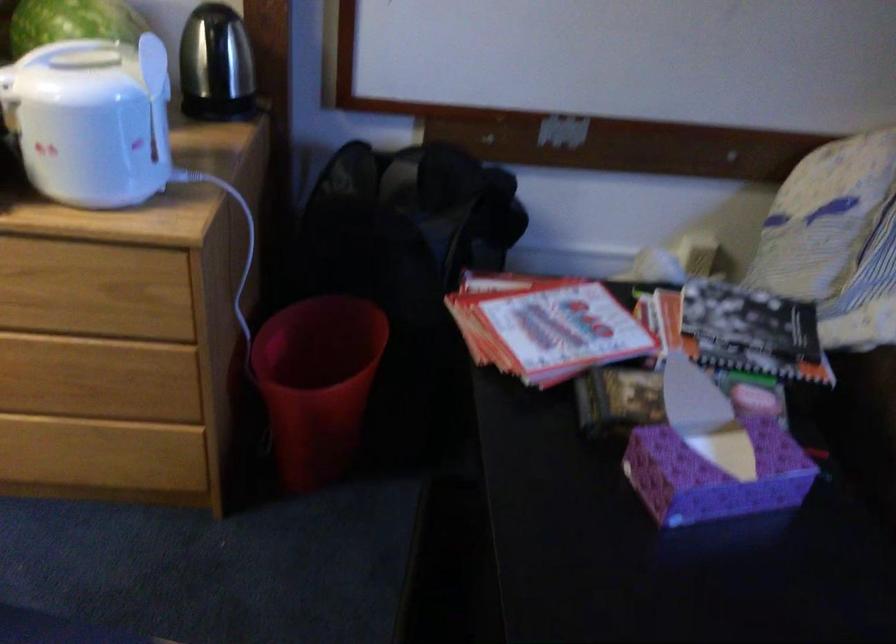
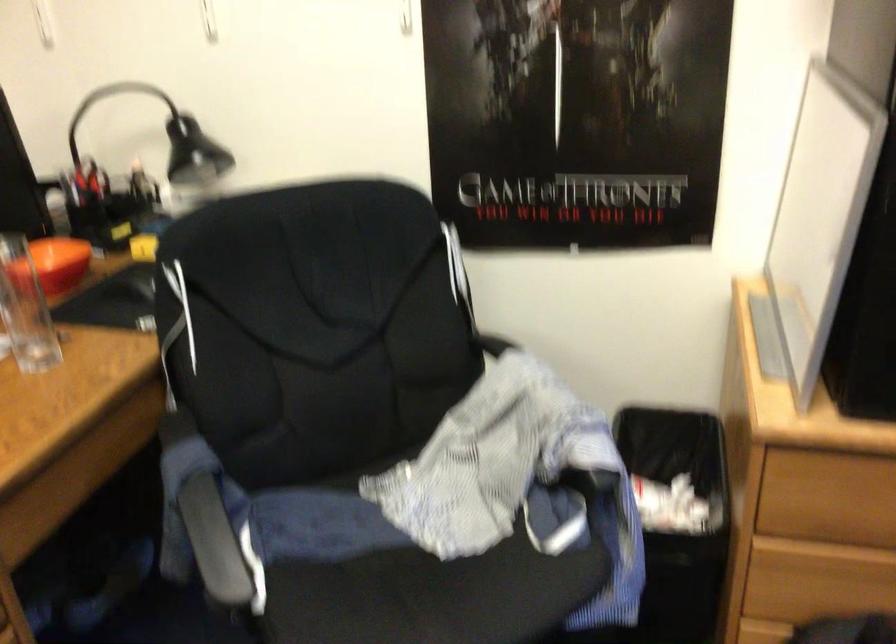
Question: Which direction would the cameraman need to move to produce the second image? Reply with the corresponding letter.

Choices:
 (A) Left
 (B) Right
 (C) Forward
 (D) Backward

Answer: (A)